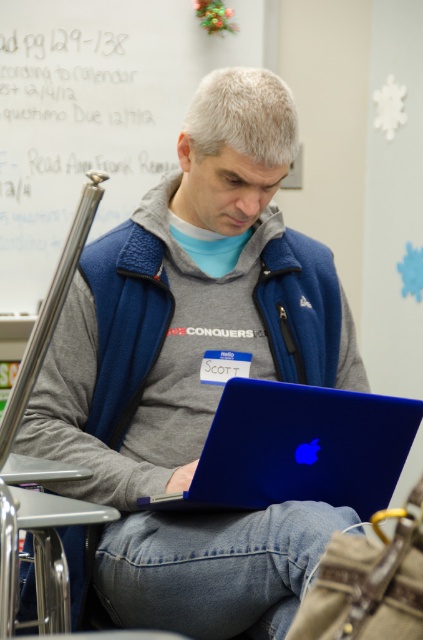
You are an interior designer assessing the space. The whiteboard at upper left and the blue glossy laptop at center are both in view. Which object is wider?

The whiteboard at upper left is wider than the blue glossy laptop at center, as its width surpasses the laptop.